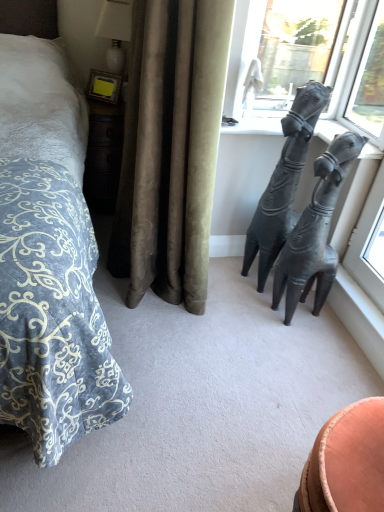
Locate an element on the screen. transparent glass window at upper right, placed as the second window when sorted from left to right is located at coordinates (369, 82).

Which object is wider, satin beige curtain at center or transparent glass window at upper right, placed as the second window when sorted from left to right?

With larger width is satin beige curtain at center.

Between point (168, 22) and point (362, 36), which one is positioned behind?

Point (362, 36)

Does point (262, 195) appear closer or farther from the camera than point (114, 66)?

Point (262, 195) appears to be closer to the viewer than point (114, 66).

Is black matte sculpture at right, which is the 2th statue (sculpture) from right to left, positioned with its back to white glossy lamp at upper left?

No, black matte sculpture at right, which is the 2th statue (sculpture) from right to left, is not facing away from white glossy lamp at upper left.

Is black matte sculpture at right, which is the 2th statue (sculpture) from right to left, closer to the viewer compared to white glossy lamp at upper left?

Yes, black matte sculpture at right, which is the 2th statue (sculpture) from right to left, is closer to the viewer.

In terms of width, does black matte hand sculpture at upper right, which is the 1th statue (sculpture) from right to left, look wider or thinner when compared to satin beige curtain at center?

Considering their sizes, black matte hand sculpture at upper right, which is the 1th statue (sculpture) from right to left, looks slimmer than satin beige curtain at center.

Considering the positions of objects black matte hand sculpture at upper right, the second statue (sculpture) positioned from the left, and satin beige curtain at center in the image provided, who is more to the left, black matte hand sculpture at upper right, the second statue (sculpture) positioned from the left, or satin beige curtain at center?

satin beige curtain at center is more to the left.

Which object is further away from the camera taking this photo, black matte hand sculpture at upper right, the second statue (sculpture) positioned from the left, or satin beige curtain at center?

black matte hand sculpture at upper right, the second statue (sculpture) positioned from the left, is behind.

Is black matte hand sculpture at upper right, which is the 1th statue (sculpture) from right to left, located outside satin beige curtain at center?

black matte hand sculpture at upper right, which is the 1th statue (sculpture) from right to left, lies outside satin beige curtain at center's area.

From a real-world perspective, is black matte sculpture at right, which is the 2th statue (sculpture) from right to left, positioned under transparent glass window at upper right, the 1th window from the right, based on gravity?

Yes, from a real-world perspective, black matte sculpture at right, which is the 2th statue (sculpture) from right to left, is below transparent glass window at upper right, the 1th window from the right.

Which is behind, black matte sculpture at right, which is counted as the first statue (sculpture), starting from the left, or transparent glass window at upper right, placed as the second window when sorted from left to right?

transparent glass window at upper right, placed as the second window when sorted from left to right, is further away from the camera.

Is black matte sculpture at right, which is counted as the first statue (sculpture), starting from the left, inside the boundaries of transparent glass window at upper right, placed as the second window when sorted from left to right, or outside?

black matte sculpture at right, which is counted as the first statue (sculpture), starting from the left, is not enclosed by transparent glass window at upper right, placed as the second window when sorted from left to right.

What are the coordinates of `the 1st window behind when counting from the black matte sculpture at right, which is the 2th statue (sculpture) from right to left` in the screenshot? It's located at (369, 82).

Can you confirm if white glossy lamp at upper left is thinner than transparent glass window at upper right, placed as the second window when sorted from left to right?

No.

Where is `the 2nd window to the right of the white glossy lamp at upper left, starting your count from the anchor`? This screenshot has height=512, width=384. the 2nd window to the right of the white glossy lamp at upper left, starting your count from the anchor is located at coordinates (369, 82).

Does point (128, 6) come farther from viewer compared to point (357, 85)?

Yes.

Is white glossy lamp at upper left turned away from transparent glass window at upper right, placed as the second window when sorted from left to right?

No.

Does black matte sculpture at right, which is the 2th statue (sculpture) from right to left, appear on the right side of satin beige curtain at center?

Correct, you'll find black matte sculpture at right, which is the 2th statue (sculpture) from right to left, to the right of satin beige curtain at center.

Is black matte sculpture at right, which is the 2th statue (sculpture) from right to left, positioned before satin beige curtain at center?

That is False.

Is black matte sculpture at right, which is counted as the first statue (sculpture), starting from the left, facing away from satin beige curtain at center?

No, black matte sculpture at right, which is counted as the first statue (sculpture), starting from the left, is not facing away from satin beige curtain at center.

Is black matte sculpture at right, which is the 2th statue (sculpture) from right to left, beside satin beige curtain at center?

They are not placed beside each other.

From the image's perspective, which is below, transparent glass window at upper right, placed as the second window when sorted from left to right, or transparent glass window at upper right, which is counted as the 1th window, starting from the left?

transparent glass window at upper right, placed as the second window when sorted from left to right, appears lower in the image.

Who is smaller, transparent glass window at upper right, the 1th window from the right, or transparent glass window at upper right, the second window from the right?

transparent glass window at upper right, the 1th window from the right, is smaller.

Can you confirm if transparent glass window at upper right, placed as the second window when sorted from left to right, is shorter than transparent glass window at upper right, the second window from the right?

No, transparent glass window at upper right, placed as the second window when sorted from left to right, is not shorter than transparent glass window at upper right, the second window from the right.

Would you consider transparent glass window at upper right, the 1th window from the right, to be distant from transparent glass window at upper right, which is counted as the 1th window, starting from the left?

transparent glass window at upper right, the 1th window from the right, is near transparent glass window at upper right, which is counted as the 1th window, starting from the left, not far away.

The height and width of the screenshot is (512, 384). What are the coordinates of `curtain below the transparent glass window at upper right, placed as the second window when sorted from left to right (from a real-world perspective)` in the screenshot? It's located at (171, 149).

Identify the location of the 1st statue (sculpture) to the right when counting from the white glossy lamp at upper left. The image size is (384, 512). (284, 182).

Considering their positions, is transparent glass window at upper right, which is counted as the 1th window, starting from the left, positioned closer to satin beige curtain at center than white glossy lamp at upper left?

transparent glass window at upper right, which is counted as the 1th window, starting from the left, lies closer to satin beige curtain at center than the other object.

Based on their spatial positions, is black matte hand sculpture at upper right, the second statue (sculpture) positioned from the left, or black matte sculpture at right, which is counted as the first statue (sculpture), starting from the left, further from transparent glass window at upper right, the second window from the right?

black matte hand sculpture at upper right, the second statue (sculpture) positioned from the left.

Looking at the image, which one is located closer to transparent glass window at upper right, which is counted as the 1th window, starting from the left, transparent glass window at upper right, the 1th window from the right, or satin beige curtain at center?

Based on the image, transparent glass window at upper right, the 1th window from the right, appears to be nearer to transparent glass window at upper right, which is counted as the 1th window, starting from the left.

Which object lies nearer to the anchor point transparent glass window at upper right, which is counted as the 1th window, starting from the left, black matte hand sculpture at upper right, the second statue (sculpture) positioned from the left, or white glossy lamp at upper left?

black matte hand sculpture at upper right, the second statue (sculpture) positioned from the left.

Estimate the real-world distances between objects in this image. Which object is closer to black matte hand sculpture at upper right, the second statue (sculpture) positioned from the left, transparent glass window at upper right, the 1th window from the right, or black matte sculpture at right, which is counted as the first statue (sculpture), starting from the left?

black matte sculpture at right, which is counted as the first statue (sculpture), starting from the left, lies closer to black matte hand sculpture at upper right, the second statue (sculpture) positioned from the left, than the other object.

Which object lies further to the anchor point black matte sculpture at right, which is the 2th statue (sculpture) from right to left, satin beige curtain at center or black matte hand sculpture at upper right, which is the 1th statue (sculpture) from right to left?

Based on the image, satin beige curtain at center appears to be further to black matte sculpture at right, which is the 2th statue (sculpture) from right to left.

When comparing their distances from white glossy lamp at upper left, does transparent glass window at upper right, the 1th window from the right, or transparent glass window at upper right, the second window from the right, seem closer?

transparent glass window at upper right, the second window from the right, is positioned closer to the anchor white glossy lamp at upper left.

Which object lies further to the anchor point black matte sculpture at right, which is counted as the first statue (sculpture), starting from the left, black matte hand sculpture at upper right, which is the 1th statue (sculpture) from right to left, or transparent glass window at upper right, which is counted as the 1th window, starting from the left?

transparent glass window at upper right, which is counted as the 1th window, starting from the left, lies further to black matte sculpture at right, which is counted as the first statue (sculpture), starting from the left, than the other object.

Where is `window between transparent glass window at upper right, the second window from the right, and black matte hand sculpture at upper right, the second statue (sculpture) positioned from the left, in the vertical direction`? This screenshot has width=384, height=512. window between transparent glass window at upper right, the second window from the right, and black matte hand sculpture at upper right, the second statue (sculpture) positioned from the left, in the vertical direction is located at coordinates (369, 82).

This screenshot has height=512, width=384. Identify the location of window situated between white glossy lamp at upper left and transparent glass window at upper right, the 1th window from the right, from left to right. (309, 66).

The image size is (384, 512). I want to click on curtain between white glossy lamp at upper left and transparent glass window at upper right, the 1th window from the right, in the horizontal direction, so click(x=171, y=149).

Where is `window between transparent glass window at upper right, the second window from the right, and black matte sculpture at right, which is counted as the first statue (sculpture), starting from the left, in the up-down direction`? The image size is (384, 512). window between transparent glass window at upper right, the second window from the right, and black matte sculpture at right, which is counted as the first statue (sculpture), starting from the left, in the up-down direction is located at coordinates point(369,82).